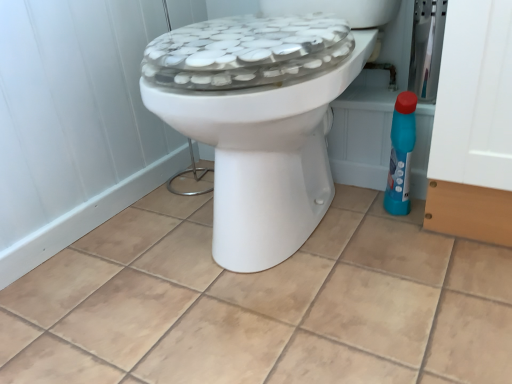
The height and width of the screenshot is (384, 512). Find the location of `empty space that is in between white glossy toilet at center and blue plastic bottle at right`. empty space that is in between white glossy toilet at center and blue plastic bottle at right is located at coordinates (364, 241).